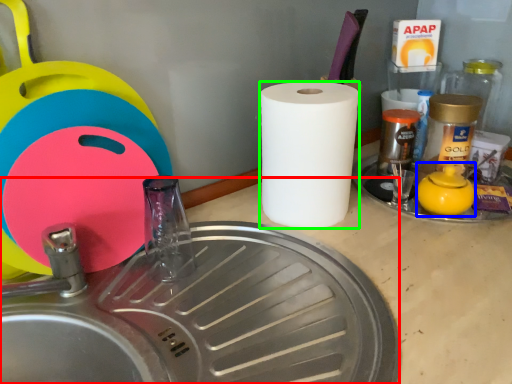
Question: Which is nearer to the sink (highlighted by a red box)? tea pot (highlighted by a blue box) or paper towel (highlighted by a green box).

Choices:
 (A) tea pot
 (B) paper towel

Answer: (B)